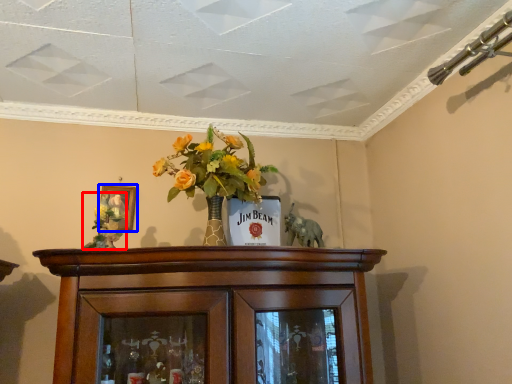
Question: Which point is closer to the camera, floral arrangement (highlighted by a red box) or picture frame (highlighted by a blue box)?

Choices:
 (A) floral arrangement
 (B) picture frame

Answer: (A)